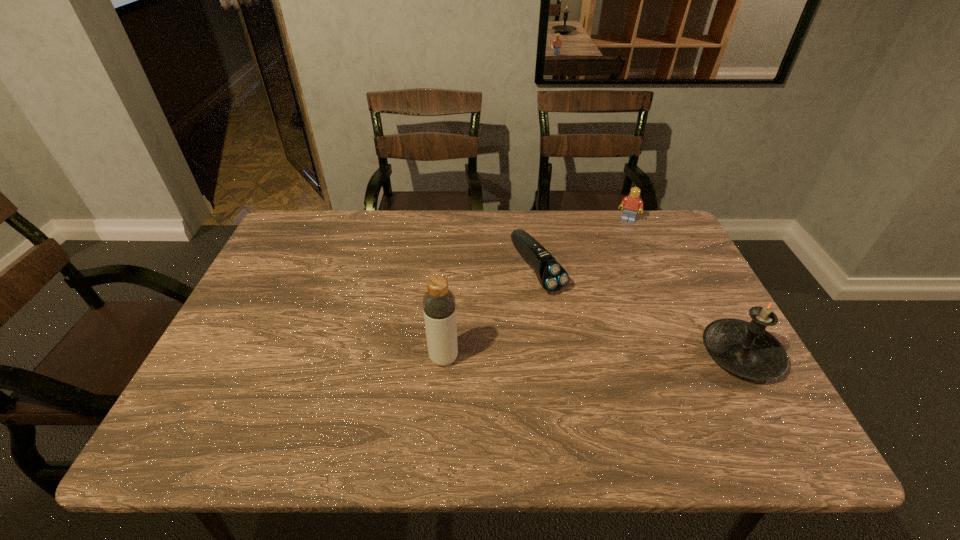
Find the location of a particular element. free space between the third tallest object and the leftmost object is located at coordinates (536, 288).

Find the location of a particular element. free space between the candle and the third nearest object is located at coordinates (639, 312).

I want to click on free point between the leftmost object and the electric shaver, so click(491, 314).

Image resolution: width=960 pixels, height=540 pixels. I want to click on unoccupied position between the third nearest object and the candle, so click(639, 312).

The image size is (960, 540). I want to click on vacant region between the second farthest object and the second shortest object, so click(x=583, y=245).

The height and width of the screenshot is (540, 960). Identify the location of free space between the third tallest object and the second tallest object. (684, 287).

Locate an element on the screen. Image resolution: width=960 pixels, height=540 pixels. free space between the Lego and the shortest object is located at coordinates (583, 245).

Where is `free space between the tallest object and the third tallest object`? free space between the tallest object and the third tallest object is located at coordinates (536, 288).

Locate an element on the screen. object that is the third closest to the third tallest object is located at coordinates (439, 307).

Where is `the second closest object to the second tallest object`? the second closest object to the second tallest object is located at coordinates (632, 203).